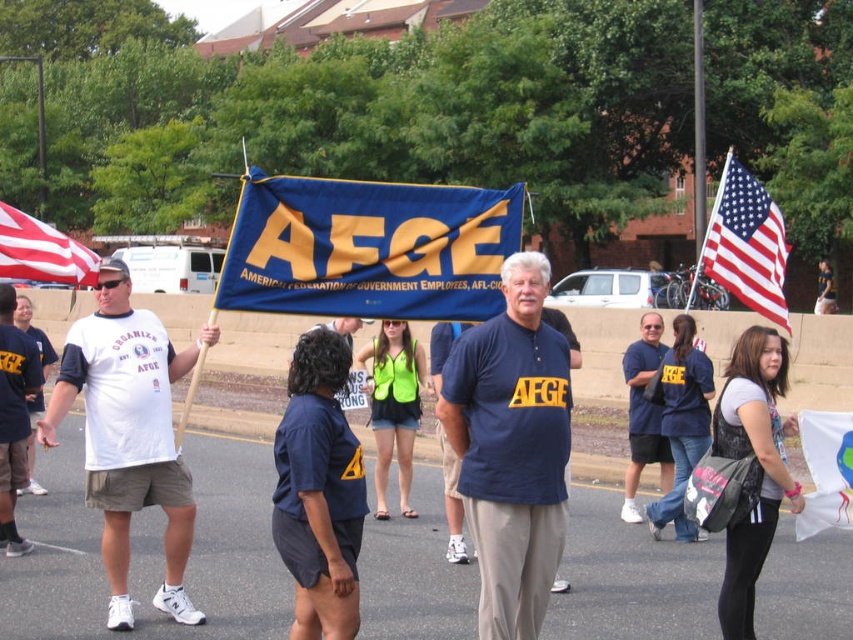
You are a photographer trying to capture the scene from the front. Which flag, the white fabric flag at lower right or the american flag at upper left, will appear taller in your photo?

The white fabric flag at lower right has a greater height compared to the american flag at upper left, so it will appear taller in the photo.